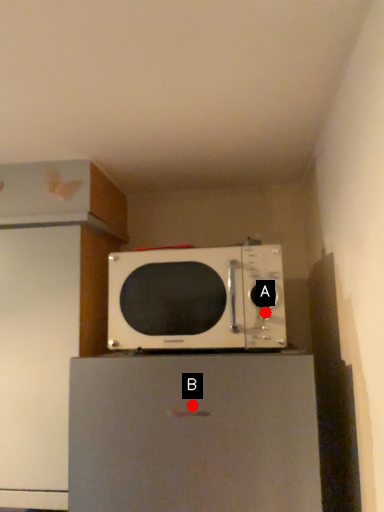
Question: Two points are circled on the image, labeled by A and B beside each circle. Which point is farther to the camera?

Choices:
 (A) A is further
 (B) B is further

Answer: (A)